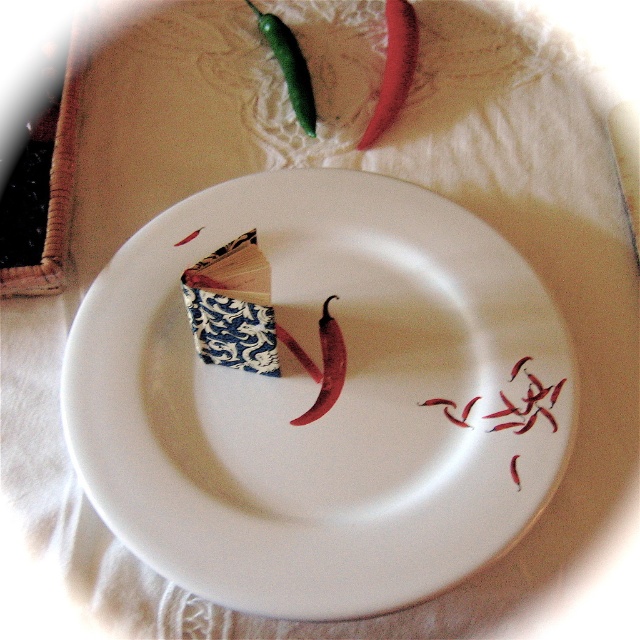
You are a chef preparing a dish and need to locate the red matte chili peppers at lower right. According to the image, where exactly are they located on the plate?

The red matte chili peppers at lower right are located at point (525, 403) on the plate.

You are arranging a table setting for a dinner party and need to place a decorative item on the table. You have the white glossy plate at center and the smooth red pepper at upper center. According to the image, which object is located above the other?

The smooth red pepper at upper center is above the white glossy plate at center because it is positioned over it.